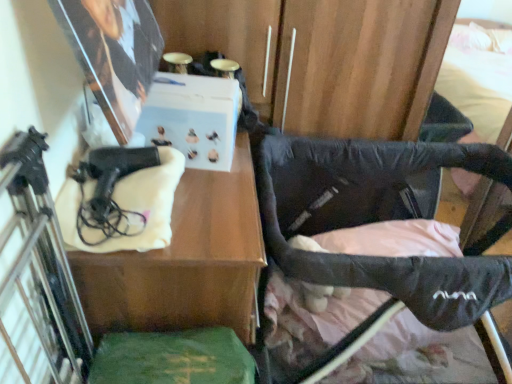
Question: Is black matte gun at left at the right side of black fabric stroller at lower right?

Choices:
 (A) yes
 (B) no

Answer: (B)

Question: Can you confirm if black matte gun at left is taller than black fabric stroller at lower right?

Choices:
 (A) no
 (B) yes

Answer: (A)

Question: Is black matte gun at left outside black fabric stroller at lower right?

Choices:
 (A) yes
 (B) no

Answer: (A)

Question: Is black matte gun at left positioned with its back to black fabric stroller at lower right?

Choices:
 (A) yes
 (B) no

Answer: (B)

Question: Is black matte gun at left wider than black fabric stroller at lower right?

Choices:
 (A) no
 (B) yes

Answer: (A)

Question: From the image's perspective, is black fabric stroller at lower right above or below green felt book at lower center?

Choices:
 (A) above
 (B) below

Answer: (A)

Question: Would you say black fabric stroller at lower right is inside or outside green felt book at lower center?

Choices:
 (A) outside
 (B) inside

Answer: (A)

Question: From their relative heights in the image, would you say black fabric stroller at lower right is taller or shorter than green felt book at lower center?

Choices:
 (A) short
 (B) tall

Answer: (B)

Question: Considering the positions of point (494, 269) and point (220, 382), is point (494, 269) closer or farther from the camera than point (220, 382)?

Choices:
 (A) farther
 (B) closer

Answer: (A)

Question: Looking at their shapes, would you say green felt book at lower center is wider or thinner than matte black hairdryer at left?

Choices:
 (A) thin
 (B) wide

Answer: (A)

Question: From a real-world perspective, is green felt book at lower center physically located above or below matte black hairdryer at left?

Choices:
 (A) below
 (B) above

Answer: (B)

Question: In terms of size, does green felt book at lower center appear bigger or smaller than matte black hairdryer at left?

Choices:
 (A) big
 (B) small

Answer: (B)

Question: Is point tap(228, 362) positioned closer to the camera than point tap(212, 246)?

Choices:
 (A) farther
 (B) closer

Answer: (B)

Question: From the image's perspective, is matte black hairdryer at left positioned above or below green felt book at lower center?

Choices:
 (A) above
 (B) below

Answer: (A)

Question: Visually, is matte black hairdryer at left positioned to the left or to the right of green felt book at lower center?

Choices:
 (A) right
 (B) left

Answer: (B)